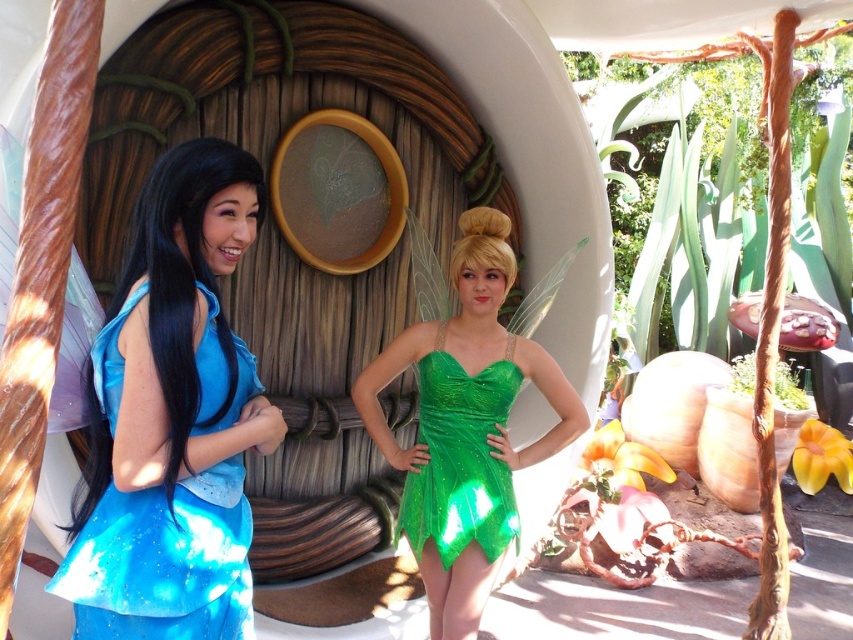
Who is shorter, shiny blue dress at left or green glittery dress at center?

Standing shorter between the two is green glittery dress at center.

Which is more to the right, shiny blue dress at left or green glittery dress at center?

From the viewer's perspective, green glittery dress at center appears more on the right side.

The width and height of the screenshot is (853, 640). What do you see at coordinates (163, 561) in the screenshot? I see `shiny blue dress at left` at bounding box center [163, 561].

The width and height of the screenshot is (853, 640). What are the coordinates of `shiny blue dress at left` in the screenshot? It's located at (163, 561).

Can you confirm if green sparkly dress at center is wider than shiny blue dress at left?

Correct, the width of green sparkly dress at center exceeds that of shiny blue dress at left.

Based on the photo, can you confirm if green sparkly dress at center is smaller than shiny blue dress at left?

No, green sparkly dress at center is not smaller than shiny blue dress at left.

You are a GUI agent. You are given a task and a screenshot of the screen. Output one action in this format:
    pyautogui.click(x=<x>, y=<y>)
    Task: Click on the green sparkly dress at center
    The image size is (853, 640).
    Given the screenshot: What is the action you would take?
    click(x=465, y=428)

The image size is (853, 640). What are the coordinates of `green sparkly dress at center` in the screenshot? It's located at (465, 428).

Who is shorter, green sparkly dress at center or green glittery dress at center?

With less height is green glittery dress at center.

Measure the distance between point (393,344) and camera.

2.89 meters

At what (x,y) coordinates should I click in order to perform the action: click on green sparkly dress at center. Please return your answer as a coordinate pair (x, y). This screenshot has height=640, width=853. Looking at the image, I should click on (465, 428).